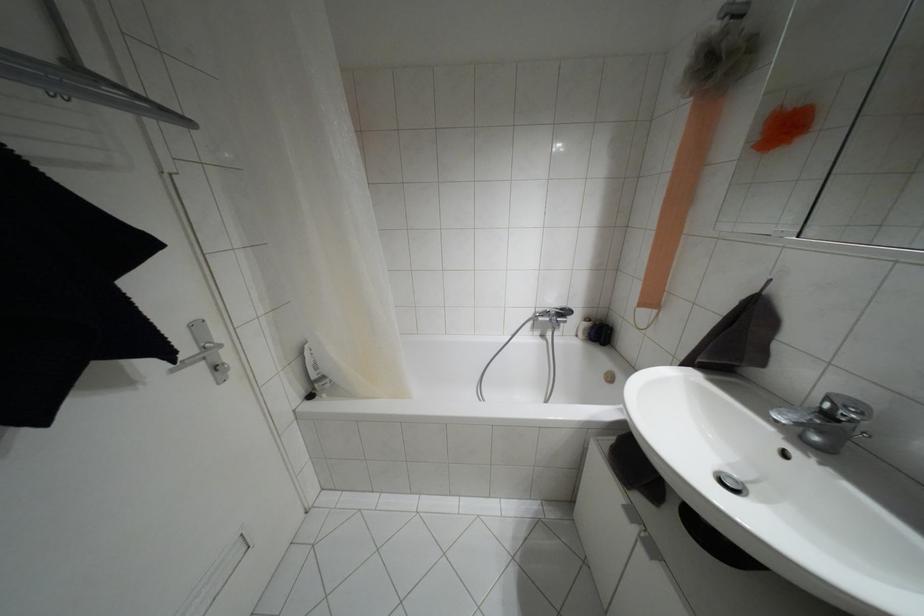
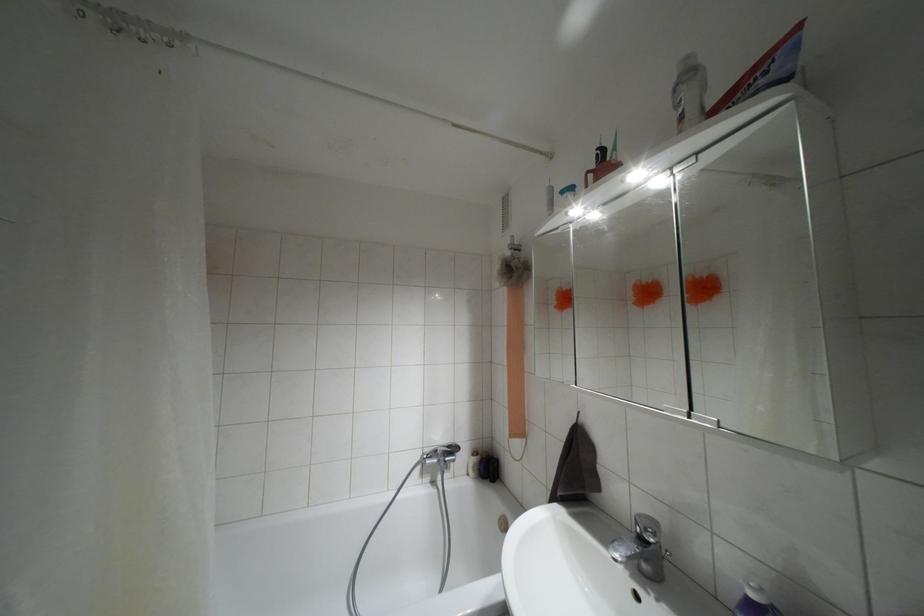
How did the camera likely rotate?

The camera's rotation is toward right-up.